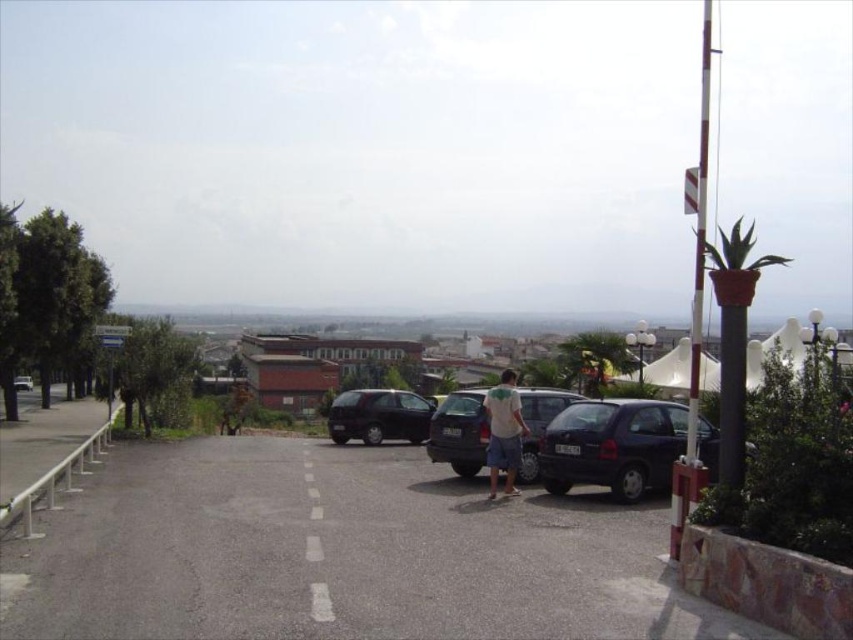
You are a delivery driver who needs to park your truck between the dark gray matte van at center and the matte black van at left. Considering their widths, which van should you position your truck closer to?

The dark gray matte van at center is thinner than the matte black van at left, so positioning your truck closer to the dark gray matte van at center would provide more space for maneuvering.

You are a delivery driver who needs to park your vehicle between the dark gray matte van at center and the matte black van at left. Based on the scene description, can you fit your vehicle there?

The dark gray matte van at center is to the right of the matte black van at left. Since the distance between them is not specified, it is uncertain if there is enough space for your vehicle.

You are a security camera installed above the parking area. You notice the white cotton shirt at center and the matte black van at left. Which object is closer to you?

The white cotton shirt at center is closer to you because it is in front of the matte black van at left.